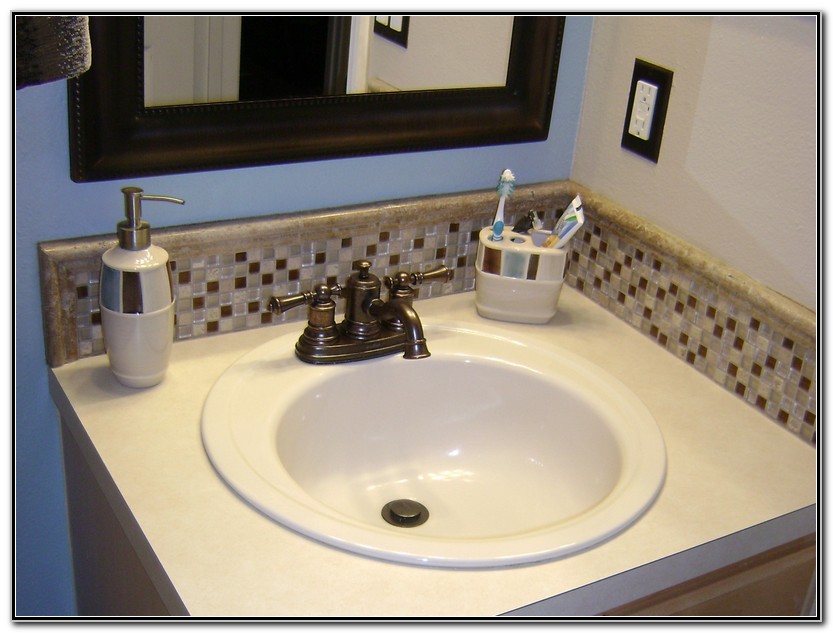
You are a GUI agent. You are given a task and a screenshot of the screen. Output one action in this format:
    pyautogui.click(x=<x>, y=<y>)
    Task: Click on the nice pink, brown, white tile
    
    Given the screenshot: What is the action you would take?
    pyautogui.click(x=725, y=333)